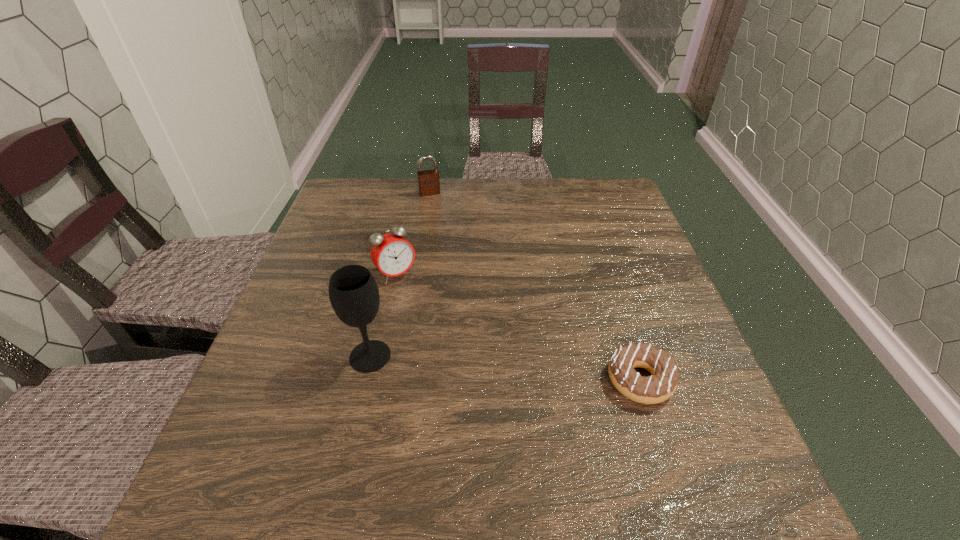
Identify the location of free space at the right edge of the desktop. (623, 322).

Image resolution: width=960 pixels, height=540 pixels. In the image, there is a desktop. Find the location of `vacant space at the far left corner`. vacant space at the far left corner is located at coordinates (330, 207).

Find the location of `vacant region at the far right corner of the desktop`. vacant region at the far right corner of the desktop is located at coordinates (574, 180).

The width and height of the screenshot is (960, 540). What are the coordinates of `vacant space that is in between the rightmost object and the tallest object` in the screenshot? It's located at (505, 368).

At what (x,y) coordinates should I click in order to perform the action: click on vacant area that lies between the alarm clock and the doughnut. Please return your answer as a coordinate pair (x, y). The height and width of the screenshot is (540, 960). Looking at the image, I should click on (518, 327).

This screenshot has width=960, height=540. What are the coordinates of `free space between the shortest object and the wineglass` in the screenshot? It's located at (505, 368).

Where is `free space that is in between the wineglass and the alarm clock`? This screenshot has width=960, height=540. free space that is in between the wineglass and the alarm clock is located at coordinates click(383, 315).

Identify the location of free spot between the rightmost object and the tallest object. (505, 368).

Find the location of a particular element. This screenshot has width=960, height=540. free space between the padlock and the alarm clock is located at coordinates (413, 234).

At what (x,y) coordinates should I click in order to perform the action: click on free point between the doughnut and the wineglass. Please return your answer as a coordinate pair (x, y). This screenshot has height=540, width=960. Looking at the image, I should click on (505, 368).